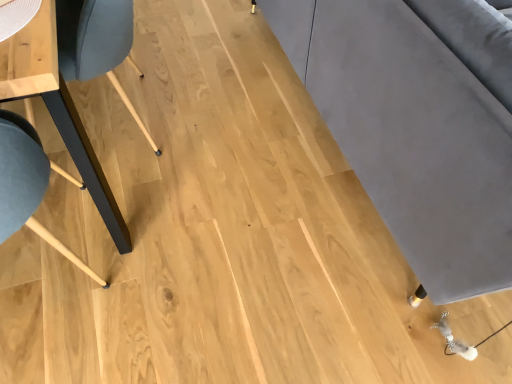
Question: Does matte wood table at left come in front of velvet grey couch at right?

Choices:
 (A) no
 (B) yes

Answer: (A)

Question: Is matte wood table at left to the left of velvet grey couch at right from the viewer's perspective?

Choices:
 (A) no
 (B) yes

Answer: (B)

Question: From a real-world perspective, is matte wood table at left on velvet grey couch at right?

Choices:
 (A) yes
 (B) no

Answer: (B)

Question: Is velvet grey couch at right surrounded by matte wood table at left?

Choices:
 (A) no
 (B) yes

Answer: (A)

Question: Is matte wood table at left far away from velvet grey couch at right?

Choices:
 (A) yes
 (B) no

Answer: (B)

Question: Is matte wood table at left facing away from velvet grey couch at right?

Choices:
 (A) yes
 (B) no

Answer: (B)

Question: Does velvet grey couch at right appear on the left side of matte wood table at left?

Choices:
 (A) yes
 (B) no

Answer: (B)

Question: Would you say velvet grey couch at right is a long distance from matte wood table at left?

Choices:
 (A) yes
 (B) no

Answer: (B)

Question: Is the position of velvet grey couch at right less distant than that of matte wood table at left?

Choices:
 (A) no
 (B) yes

Answer: (B)

Question: Does velvet grey couch at right appear on the right side of matte wood table at left?

Choices:
 (A) yes
 (B) no

Answer: (A)

Question: Is velvet grey couch at right located outside matte wood table at left?

Choices:
 (A) yes
 (B) no

Answer: (A)

Question: Does velvet grey couch at right have a smaller size compared to matte wood table at left?

Choices:
 (A) yes
 (B) no

Answer: (B)

Question: In the image, is velvet grey couch at right on the left side or the right side of matte wood table at left?

Choices:
 (A) right
 (B) left

Answer: (A)